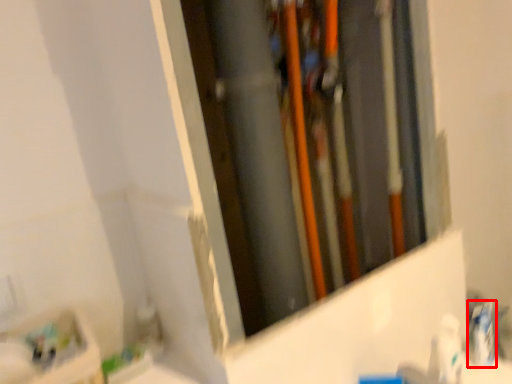
Question: Considering the relative positions of toothpaste (annotated by the red box) and toiletry in the image provided, where is toothpaste (annotated by the red box) located with respect to the staircase?

Choices:
 (A) right
 (B) left

Answer: (A)